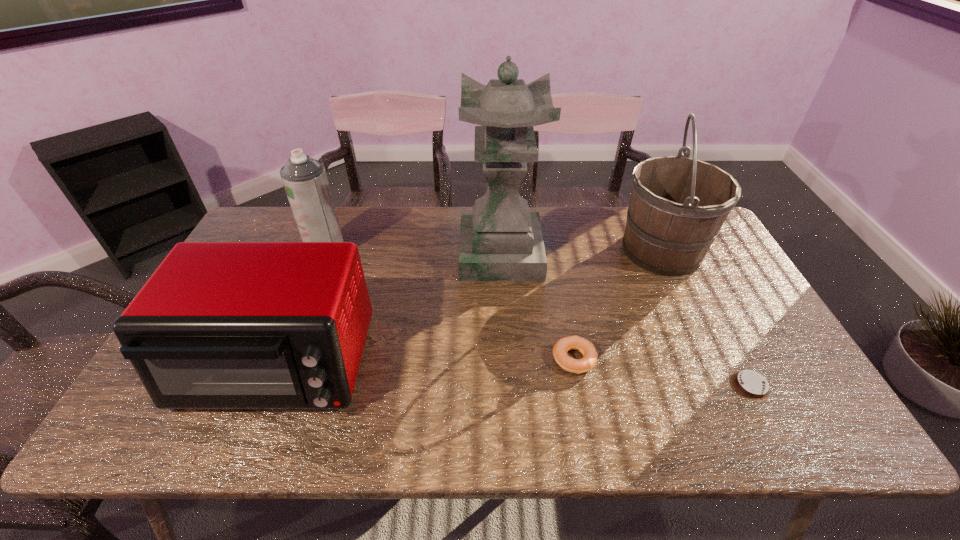
Locate an element on the screen. This screenshot has height=540, width=960. sculpture is located at coordinates (501, 240).

At what (x,y) coordinates should I click in order to perform the action: click on bucket. Please return your answer as a coordinate pair (x, y). Looking at the image, I should click on (678, 205).

This screenshot has width=960, height=540. I want to click on the third tallest object, so click(x=305, y=181).

Locate an element on the screen. the third shortest object is located at coordinates (219, 325).

At what (x,y) coordinates should I click in order to perform the action: click on the second shortest object. Please return your answer as a coordinate pair (x, y). The image size is (960, 540). Looking at the image, I should click on (585, 364).

The height and width of the screenshot is (540, 960). I want to click on chocolate cake, so click(751, 385).

At what (x,y) coordinates should I click in order to perform the action: click on free space located at the front opening of the tallest object. Please return your answer as a coordinate pair (x, y). The height and width of the screenshot is (540, 960). Looking at the image, I should click on (416, 254).

You are a GUI agent. You are given a task and a screenshot of the screen. Output one action in this format:
    pyautogui.click(x=<x>, y=<y>)
    Task: Click on the vacant space located 0.220m at the front opening of the tallest object
    Image resolution: width=960 pixels, height=540 pixels.
    Given the screenshot: What is the action you would take?
    pyautogui.click(x=391, y=254)

Find the location of a particular element. This screenshot has height=540, width=960. vacant space located 0.060m at the front opening of the tallest object is located at coordinates (442, 254).

Where is `free space located 0.330m on the front of the second tallest object`? The image size is (960, 540). free space located 0.330m on the front of the second tallest object is located at coordinates (722, 379).